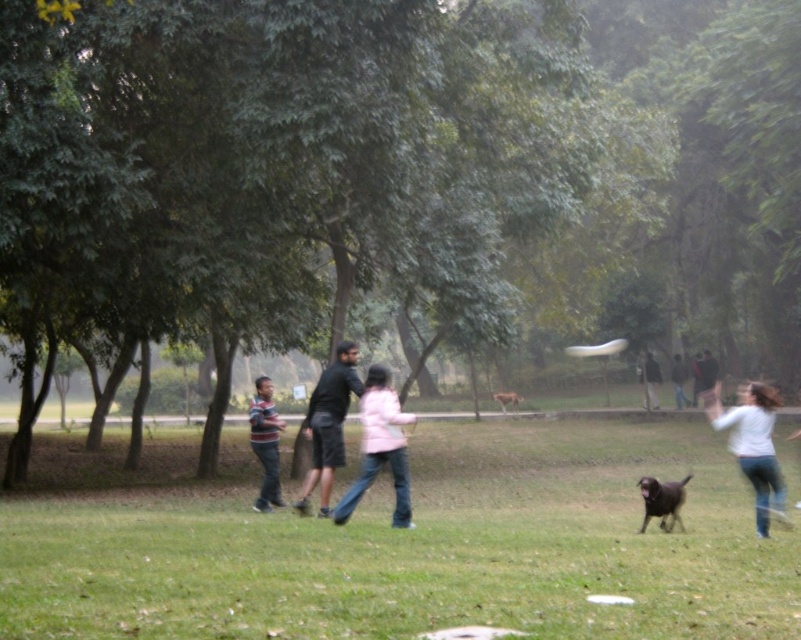
Does dark gray fabric pants at center have a smaller size compared to brown furry dog at center?

Actually, dark gray fabric pants at center might be larger than brown furry dog at center.

Between point (333, 396) and point (501, 396), which one is positioned behind?

Positioned behind is point (501, 396).

This screenshot has height=640, width=801. Identify the location of dark gray fabric pants at center. (328, 424).

Between dark gray fabric pants at center and light blue jeans at lower right, which one appears on the right side from the viewer's perspective?

Positioned to the right is light blue jeans at lower right.

Can you confirm if dark gray fabric pants at center is positioned above light blue jeans at lower right?

Yes.

You are a GUI agent. You are given a task and a screenshot of the screen. Output one action in this format:
    pyautogui.click(x=<x>, y=<y>)
    Task: Click on the dark gray fabric pants at center
    The image size is (801, 640).
    Given the screenshot: What is the action you would take?
    pyautogui.click(x=328, y=424)

Where is `dark gray fabric pants at center`? This screenshot has width=801, height=640. dark gray fabric pants at center is located at coordinates (328, 424).

Between dark gray fabric pants at center and dark gray sweater at center, which one is positioned higher?

dark gray fabric pants at center

Can you confirm if dark gray fabric pants at center is thinner than dark gray sweater at center?

No, dark gray fabric pants at center is not thinner than dark gray sweater at center.

Between point (325, 481) and point (657, 378), which one is positioned behind?

Positioned behind is point (657, 378).

Locate an element on the screen. dark gray fabric pants at center is located at coordinates (328, 424).